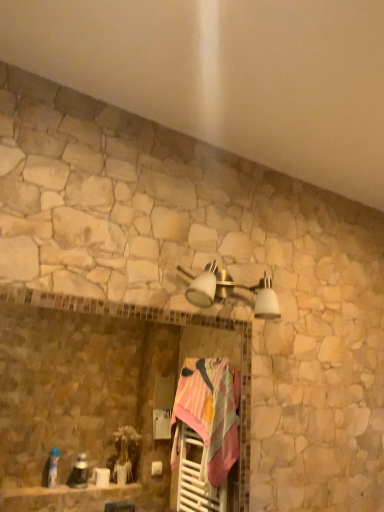
What do you see at coordinates (229, 290) in the screenshot?
I see `white glossy lamp at upper center` at bounding box center [229, 290].

Find the location of a particular element. The height and width of the screenshot is (512, 384). white glossy lamp at upper center is located at coordinates (229, 290).

What is the approximate width of white glossy lamp at upper center?

It is 5.47 inches.

I want to click on white glossy lamp at upper center, so click(229, 290).